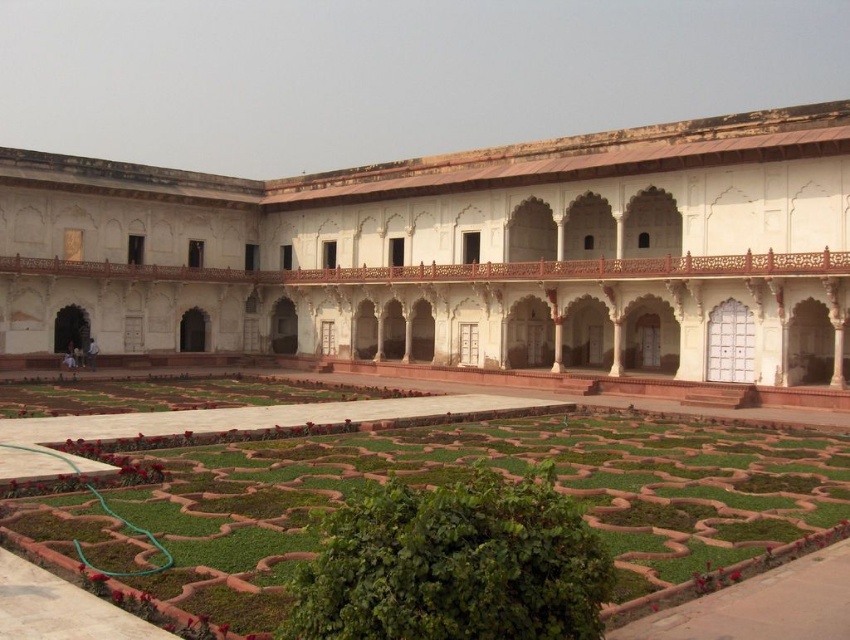
Question: Is white marble palace at center smaller than green grass at center?

Choices:
 (A) yes
 (B) no

Answer: (B)

Question: Is white marble palace at center below green grass at center?

Choices:
 (A) no
 (B) yes

Answer: (A)

Question: Which of the following is the closest to the observer?

Choices:
 (A) white marble palace at center
 (B) green grass at center

Answer: (B)

Question: In this image, where is white marble palace at center located relative to green grass at center?

Choices:
 (A) above
 (B) below

Answer: (A)

Question: Which point is closer to the camera?

Choices:
 (A) (256, 464)
 (B) (706, 232)

Answer: (A)

Question: Which of the following is the closest to the observer?

Choices:
 (A) white marble palace at center
 (B) green grass at center

Answer: (B)